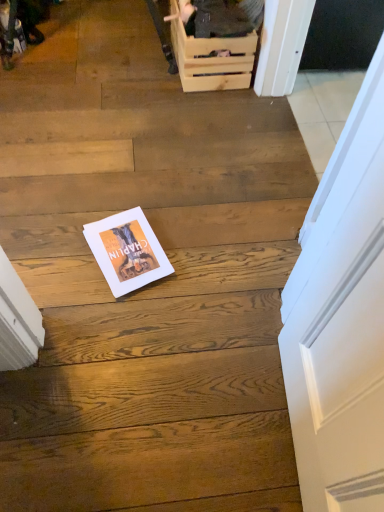
At what (x,y) coordinates should I click in order to perform the action: click on vacant area that lies in front of wooden crate at upper center. Please return your answer as a coordinate pair (x, y). The width and height of the screenshot is (384, 512). Looking at the image, I should click on (188, 109).